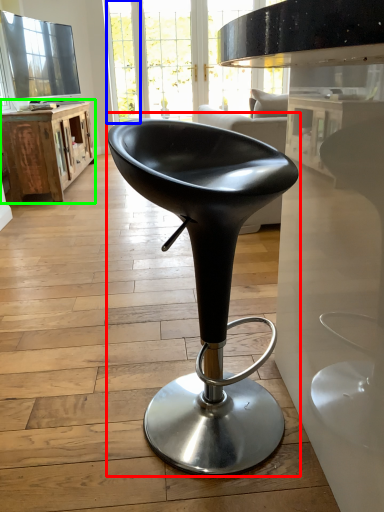
Question: Which object is positioned closest to chair (highlighted by a red box)? Select from glass door (highlighted by a blue box) and table (highlighted by a green box).

Choices:
 (A) glass door
 (B) table

Answer: (B)